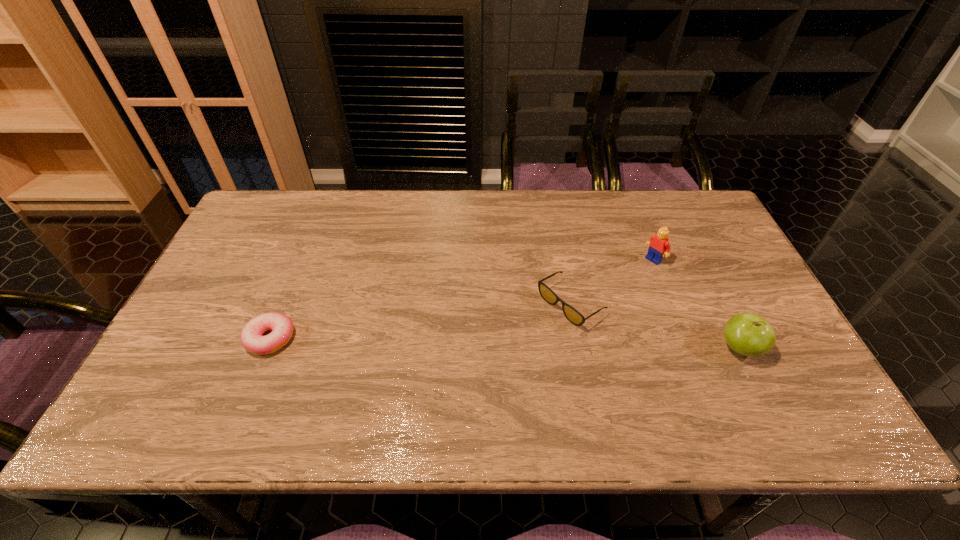
Where is `vacant position located 0.210m on the face of the second object from right to left`? This screenshot has height=540, width=960. vacant position located 0.210m on the face of the second object from right to left is located at coordinates (602, 300).

Find the location of a particular element. vacant area located on the face of the second object from right to left is located at coordinates (592, 307).

Where is `vacant space situated on the front-facing side of the third object from right to left`? The width and height of the screenshot is (960, 540). vacant space situated on the front-facing side of the third object from right to left is located at coordinates pyautogui.click(x=530, y=332).

Locate an element on the screen. The height and width of the screenshot is (540, 960). free location located on the front-facing side of the third object from right to left is located at coordinates (470, 373).

At what (x,y) coordinates should I click in order to perform the action: click on vacant space positioned on the front-facing side of the third object from right to left. Please return your answer as a coordinate pair (x, y). This screenshot has width=960, height=540. Looking at the image, I should click on (464, 377).

Locate an element on the screen. Image resolution: width=960 pixels, height=540 pixels. object that is at the near edge is located at coordinates (747, 334).

Find the location of `object present at the right edge`. object present at the right edge is located at coordinates (747, 334).

Find the location of a particular element. The image size is (960, 540). object that is at the near right corner is located at coordinates (747, 334).

Where is `free space at the far edge of the desktop`? free space at the far edge of the desktop is located at coordinates (441, 198).

Find the location of a particular element. The image size is (960, 540). vacant space at the near edge of the desktop is located at coordinates (417, 382).